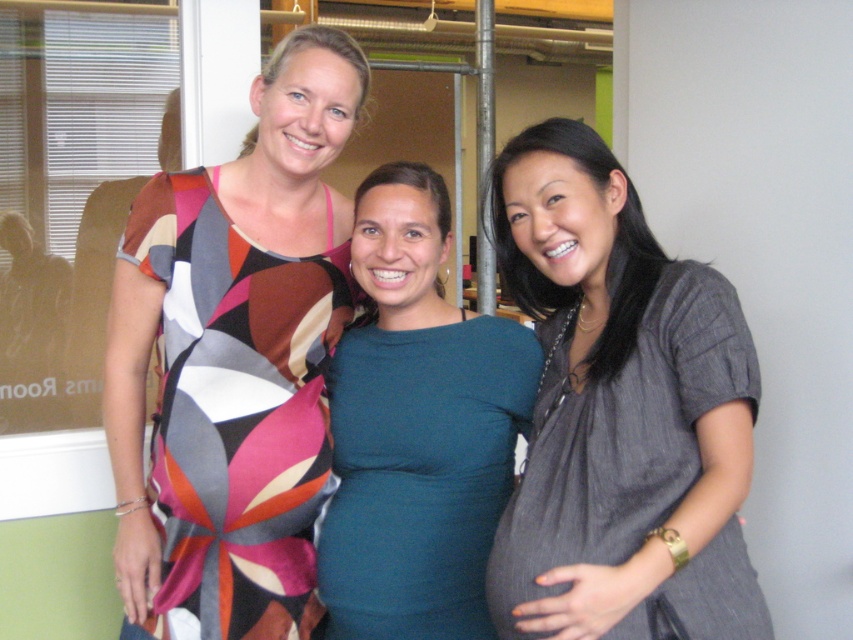
Question: Estimate the real-world distances between objects in this image. Which object is closer to the gray textured dress at center?

Choices:
 (A) multicolored fabric dress at left
 (B) teal jersey dress at center

Answer: (B)

Question: Can you confirm if gray textured dress at center is smaller than multicolored fabric dress at left?

Choices:
 (A) no
 (B) yes

Answer: (A)

Question: Can you confirm if gray textured dress at center is positioned above multicolored fabric dress at left?

Choices:
 (A) no
 (B) yes

Answer: (B)

Question: Which point appears farthest from the camera in this image?

Choices:
 (A) 462,541
 (B) 164,230

Answer: (B)

Question: Observing the image, what is the correct spatial positioning of multicolored fabric dress at left in reference to teal jersey dress at center?

Choices:
 (A) left
 (B) right

Answer: (A)

Question: Which is farther from the teal jersey dress at center?

Choices:
 (A) multicolored fabric dress at left
 (B) gray textured dress at center

Answer: (B)